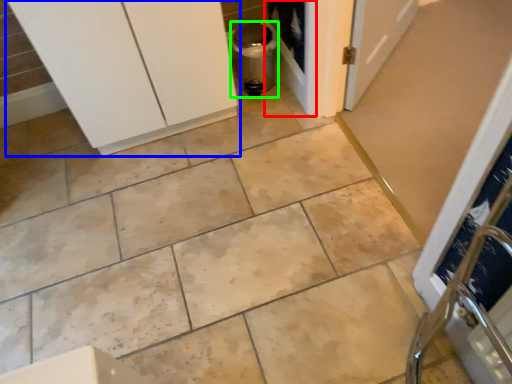
Question: Considering the real-world distances, which object is farthest from screen door (highlighted by a red box)? door (highlighted by a blue box) or appliance (highlighted by a green box)?

Choices:
 (A) door
 (B) appliance

Answer: (A)